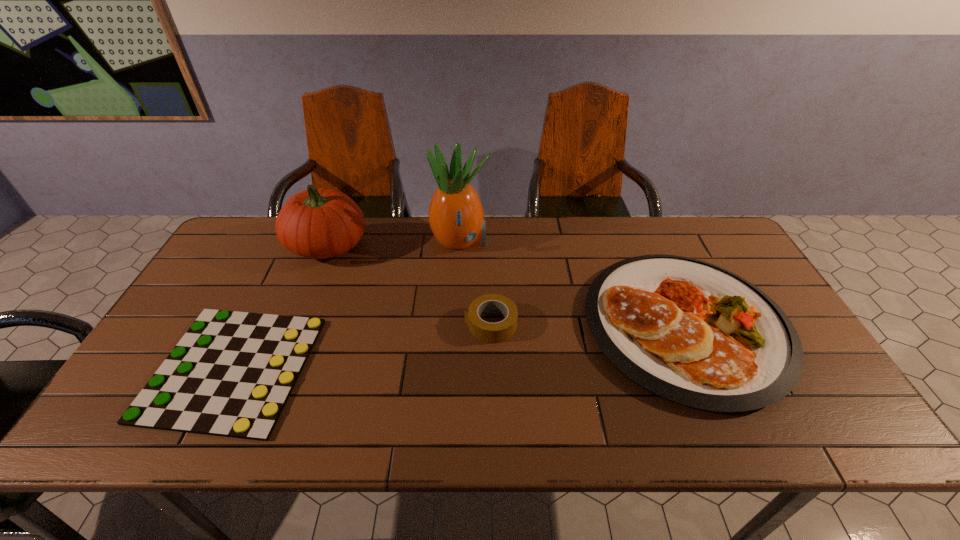
The height and width of the screenshot is (540, 960). I want to click on unoccupied position between the second tallest object and the shortest object, so click(280, 307).

Where is `vacant point located between the third shortest object and the tallest object`? vacant point located between the third shortest object and the tallest object is located at coordinates (573, 284).

Locate an element on the screen. The image size is (960, 540). empty location between the second shortest object and the second tallest object is located at coordinates (409, 285).

This screenshot has height=540, width=960. I want to click on free point between the shortest object and the pumpkin, so click(280, 307).

This screenshot has width=960, height=540. In order to click on empty space between the checkerboard and the rightmost object in this screenshot , I will do `click(459, 347)`.

Where is `vacant area that lies between the second tallest object and the checkerboard`? vacant area that lies between the second tallest object and the checkerboard is located at coordinates (280, 307).

The width and height of the screenshot is (960, 540). I want to click on blank region between the duct tape and the checkerboard, so click(362, 346).

Locate which object ranks in proximity to the shortest object. Please provide its 2D coordinates. Your answer should be formatted as a tuple, i.e. [(x, y)], where the tuple contains the x and y coordinates of a point satisfying the conditions above.

[(318, 223)]

Identify which object is located as the nearest to the dish. Please provide its 2D coordinates. Your answer should be formatted as a tuple, i.e. [(x, y)], where the tuple contains the x and y coordinates of a point satisfying the conditions above.

[(488, 332)]

Locate an element on the screen. This screenshot has height=540, width=960. free space that satisfies the following two spatial constraints: 1. at the entrance of the tallest object; 2. on the front side of the checkerboard is located at coordinates (454, 368).